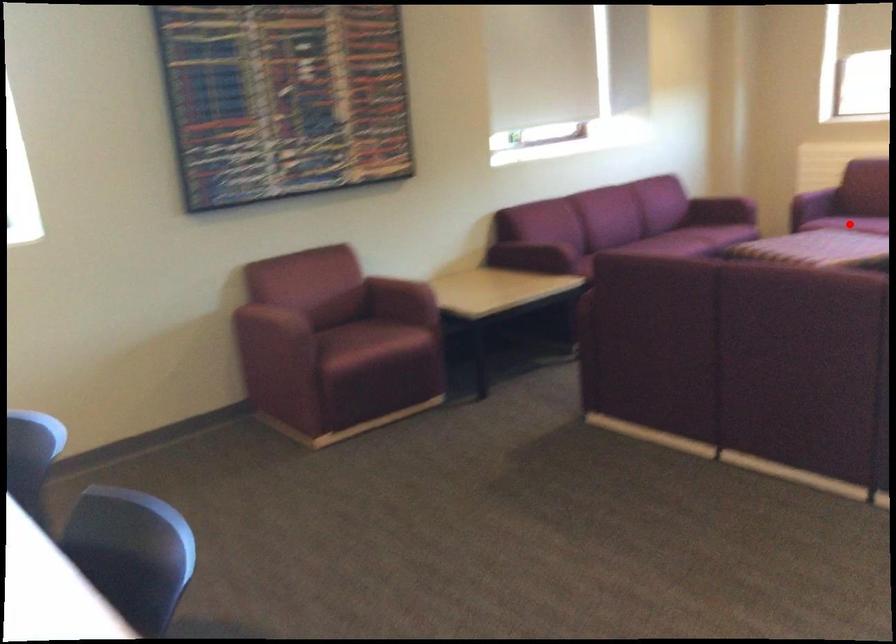
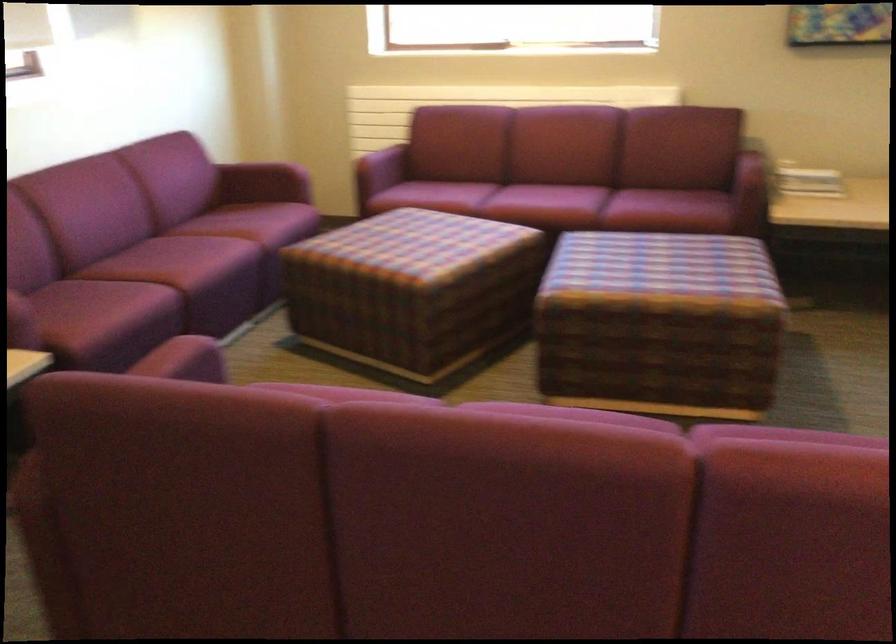
Question: I am providing you with two images of the same scene from different viewpoints. A red point is marked on the first image. Can you still see the location of the red point in image 2?

Choices:
 (A) Yes
 (B) No

Answer: (B)